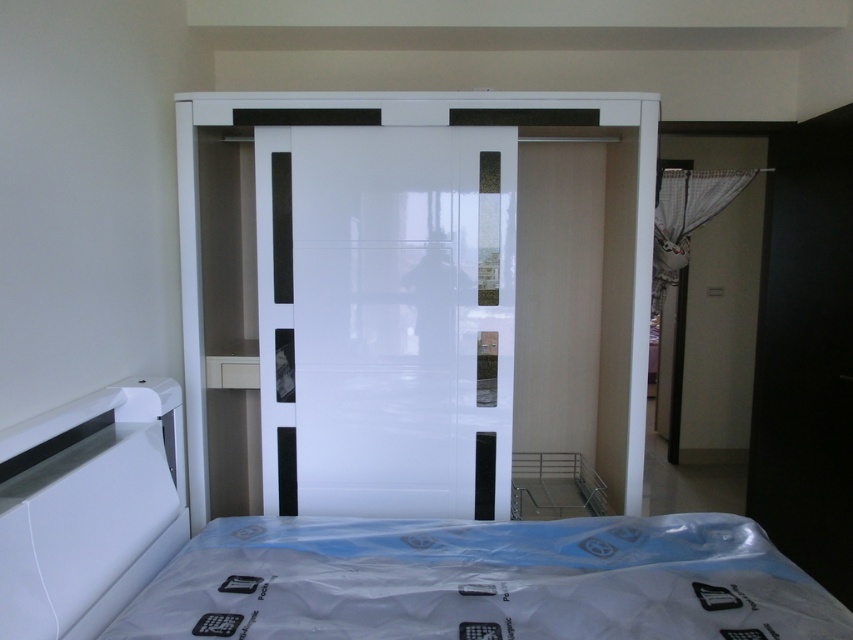
You are a delivery person trying to place a 12 inch wide package between the glossy white glass door at center and the glossy white wardrobe at center. Can the package fit in the space between them?

The glossy white glass door at center and glossy white wardrobe at center are 12.38 inches apart. Since the package is 12 inches wide, it can fit in the space between them as the available space is slightly larger than the package width.

From the picture: You are planning to rearrange the furniture in the bedroom and need to know which takes up more floor space between the white glossy bed at center and the glossy white wardrobe at center. Based on the scene description, which one requires more space?

The glossy white wardrobe at center occupies more space than the white glossy bed at center, so it requires more floor space.